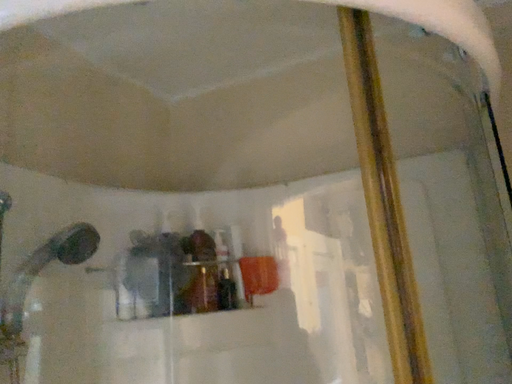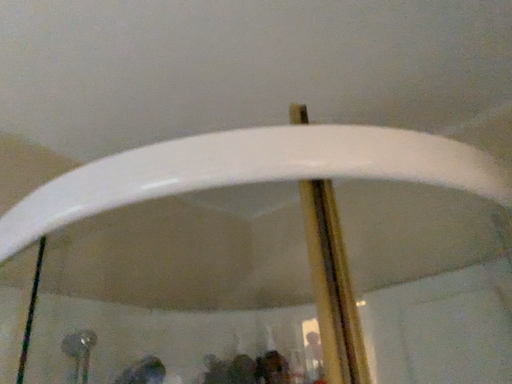
Question: Which way did the camera rotate in the video?

Choices:
 (A) rotated downward
 (B) rotated upward

Answer: (B)